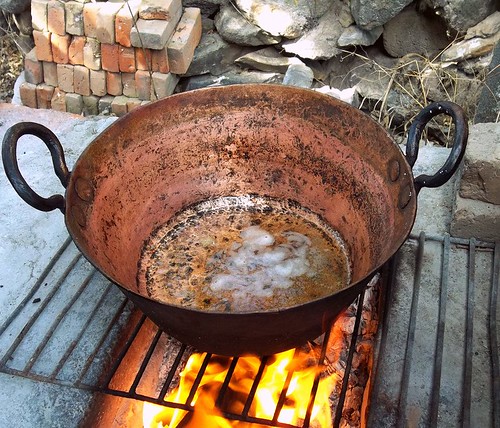
Locate an element on the screen. bottom of inside of pan is located at coordinates (222, 233).